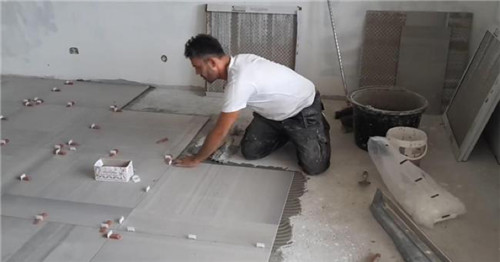
Image resolution: width=500 pixels, height=262 pixels. Identify the location of vent cover. (469, 113).